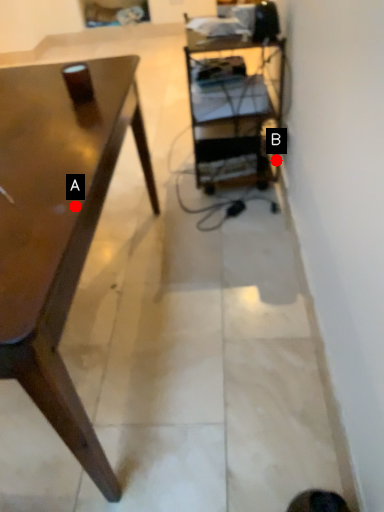
Question: Two points are circled on the image, labeled by A and B beside each circle. Which point is closer to the camera taking this photo?

Choices:
 (A) A is closer
 (B) B is closer

Answer: (A)